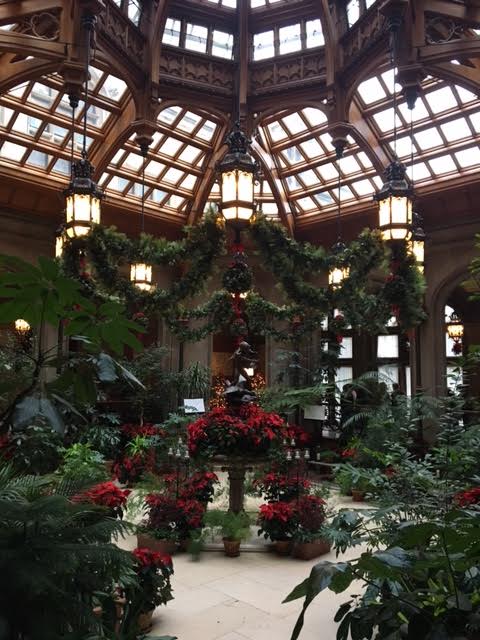
This screenshot has height=640, width=480. In order to click on left planter box, to left of center pedestal display in this screenshot , I will do `click(172, 541)`.